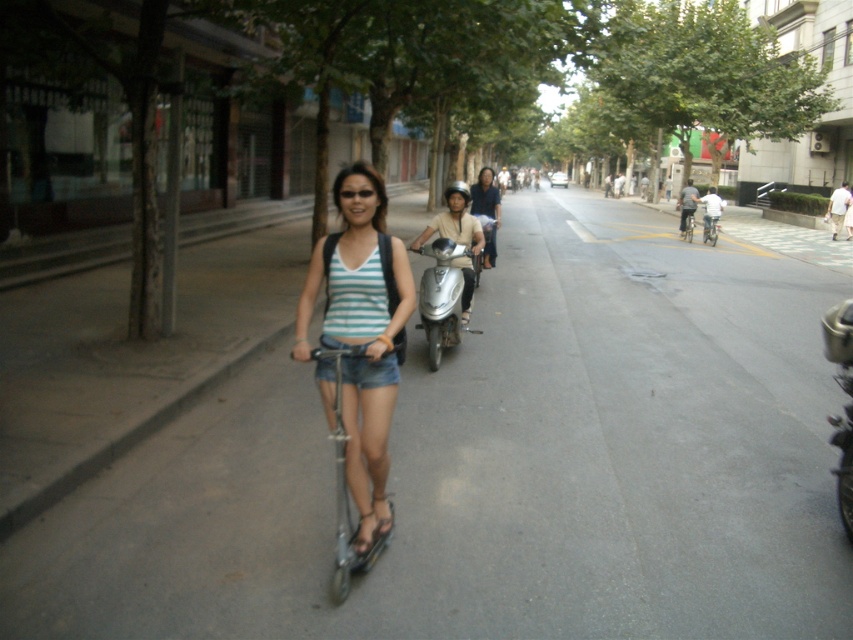
Does gray asphalt road at center have a greater width compared to shiny chrome motorcycle at right?

Correct, the width of gray asphalt road at center exceeds that of shiny chrome motorcycle at right.

Between gray asphalt road at center and shiny chrome motorcycle at right, which one appears on the right side from the viewer's perspective?

From the viewer's perspective, gray asphalt road at center appears more on the right side.

Between point (809, 291) and point (846, 404), which one is positioned behind?

Point (809, 291)

Identify the location of gray asphalt road at center. (500, 467).

Measure the distance between matte striped tank top at center and camera.

The distance of matte striped tank top at center from camera is 3.66 meters.

In the scene shown: Does matte striped tank top at center appear under shiny chrome motorcycle at right?

Actually, matte striped tank top at center is above shiny chrome motorcycle at right.

Who is more forward, (366, 374) or (842, 333)?

Point (366, 374)

The height and width of the screenshot is (640, 853). I want to click on matte striped tank top at center, so click(x=361, y=333).

Does silver metallic scooter at center have a larger size compared to silver metallic bicycle at center?

Indeed, silver metallic scooter at center has a larger size compared to silver metallic bicycle at center.

Between silver metallic scooter at center and silver metallic bicycle at center, which one has less height?

Standing shorter between the two is silver metallic bicycle at center.

Does point (434, 333) come farther from viewer compared to point (718, 227)?

No, (434, 333) is in front of (718, 227).

Find the location of a particular element. Image resolution: width=853 pixels, height=640 pixels. silver metallic scooter at center is located at coordinates (444, 296).